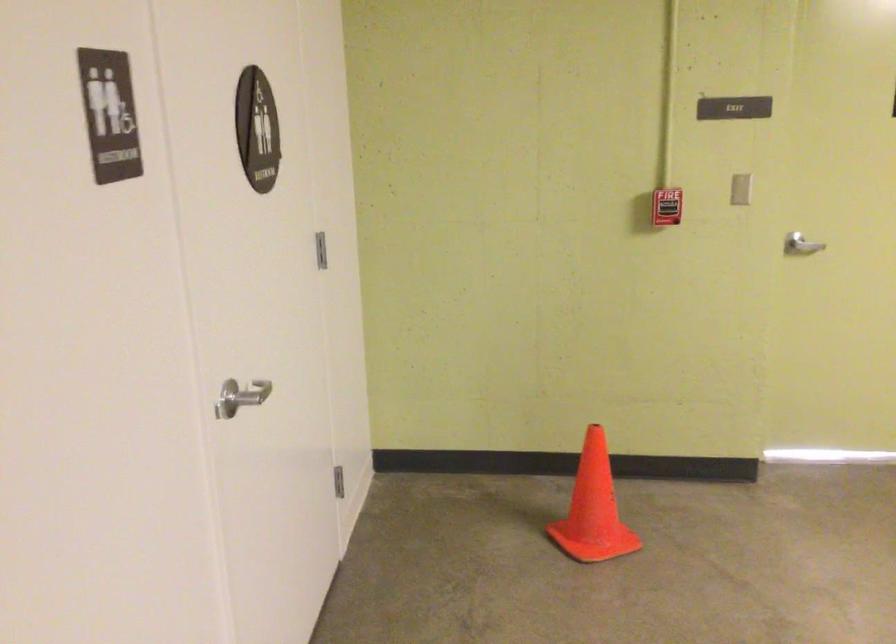
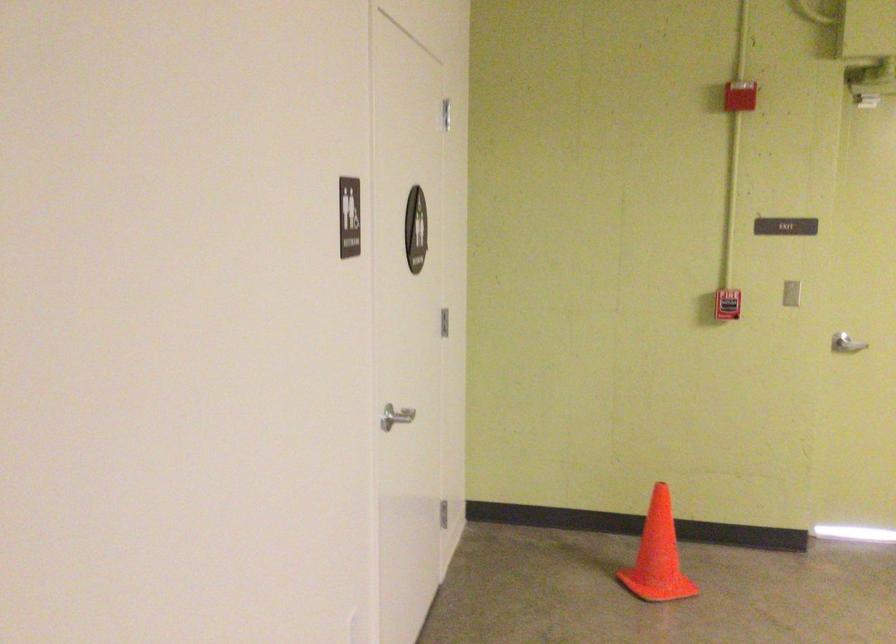
Find the pixel in the second image that matches point 246,382 in the first image.

(394, 415)